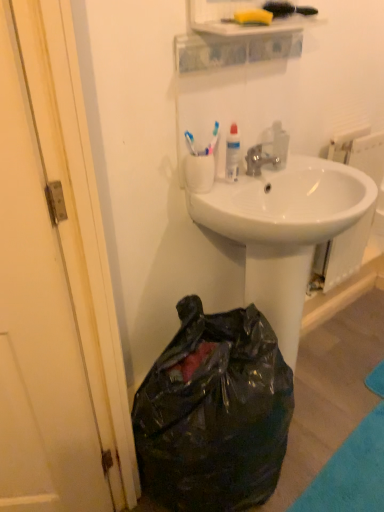
Question: Is white glossy radiator at upper right far away from white plastic cup at upper center?

Choices:
 (A) yes
 (B) no

Answer: (B)

Question: From a real-world perspective, is white glossy radiator at upper right beneath white plastic cup at upper center?

Choices:
 (A) yes
 (B) no

Answer: (A)

Question: Considering the relative positions of white glossy radiator at upper right and white plastic cup at upper center in the image provided, is white glossy radiator at upper right to the right of white plastic cup at upper center from the viewer's perspective?

Choices:
 (A) no
 (B) yes

Answer: (B)

Question: Is white glossy radiator at upper right taller than white plastic cup at upper center?

Choices:
 (A) yes
 (B) no

Answer: (A)

Question: Does white glossy radiator at upper right have a lesser height compared to white plastic cup at upper center?

Choices:
 (A) yes
 (B) no

Answer: (B)

Question: Is white glossy radiator at upper right facing away from white plastic cup at upper center?

Choices:
 (A) yes
 (B) no

Answer: (B)

Question: Considering the relative positions of black plastic bag at lower left and silver metallic faucet at center in the image provided, is black plastic bag at lower left to the left of silver metallic faucet at center from the viewer's perspective?

Choices:
 (A) yes
 (B) no

Answer: (A)

Question: Can you confirm if black plastic bag at lower left is taller than silver metallic faucet at center?

Choices:
 (A) yes
 (B) no

Answer: (A)

Question: Does black plastic bag at lower left come behind silver metallic faucet at center?

Choices:
 (A) yes
 (B) no

Answer: (B)

Question: From the image's perspective, is black plastic bag at lower left above silver metallic faucet at center?

Choices:
 (A) no
 (B) yes

Answer: (A)

Question: Is black plastic bag at lower left closer to the viewer compared to silver metallic faucet at center?

Choices:
 (A) no
 (B) yes

Answer: (B)

Question: Can silver metallic faucet at center be found inside black plastic bag at lower left?

Choices:
 (A) yes
 (B) no

Answer: (B)

Question: Does black plastic bag at lower left have a lesser height compared to white plastic cup at upper center?

Choices:
 (A) no
 (B) yes

Answer: (A)